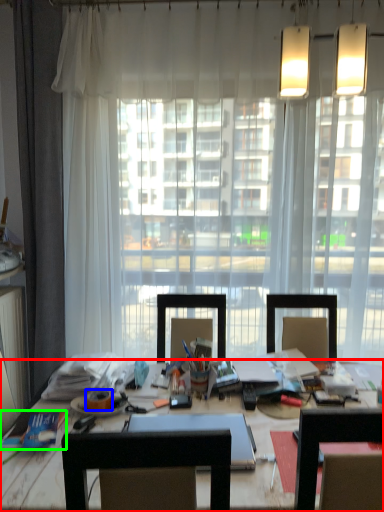
Question: Which is nearer to the desk (highlighted by a red box)? adhesive tape (highlighted by a blue box) or book (highlighted by a green box).

Choices:
 (A) adhesive tape
 (B) book

Answer: (B)